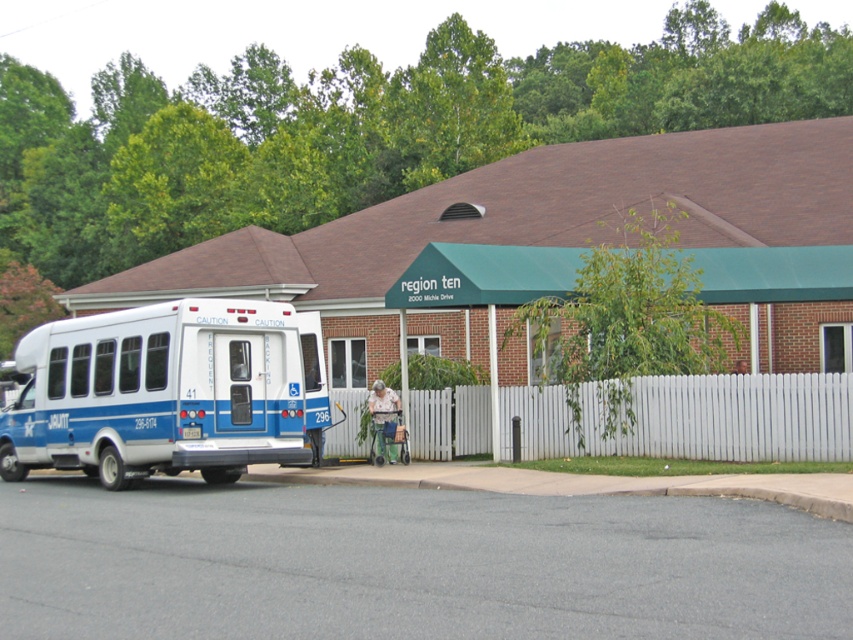
Based on the photo, you are a pedestrian standing on the sidewalk in front of the Region Ten building. You want to cross the street to reach the white picket fence at center. Is the white glossy ambulance at left blocking your path?

The white glossy ambulance at left is further to the viewer than the white picket fence at center, so it is closer to you. This means the ambulance is blocking your path to the white picket fence at center.

You are a delivery driver who needs to park your vehicle between the white glossy ambulance at left and the white picket fence at center. Given the space constraints, can you fit your standard delivery van which requires 5 meters of space?

The white glossy ambulance at left occupies less space than white picket fence at center. However, the total available space between them isn not specified. Without knowing the exact distance between the ambulance and the fence, it is impossible to determine if the van requiring 5 meters can fit.